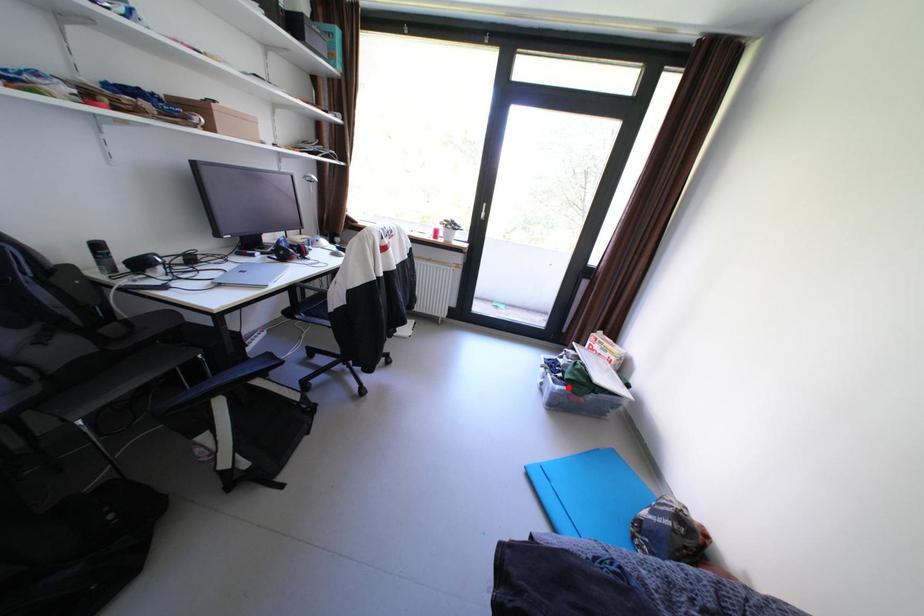
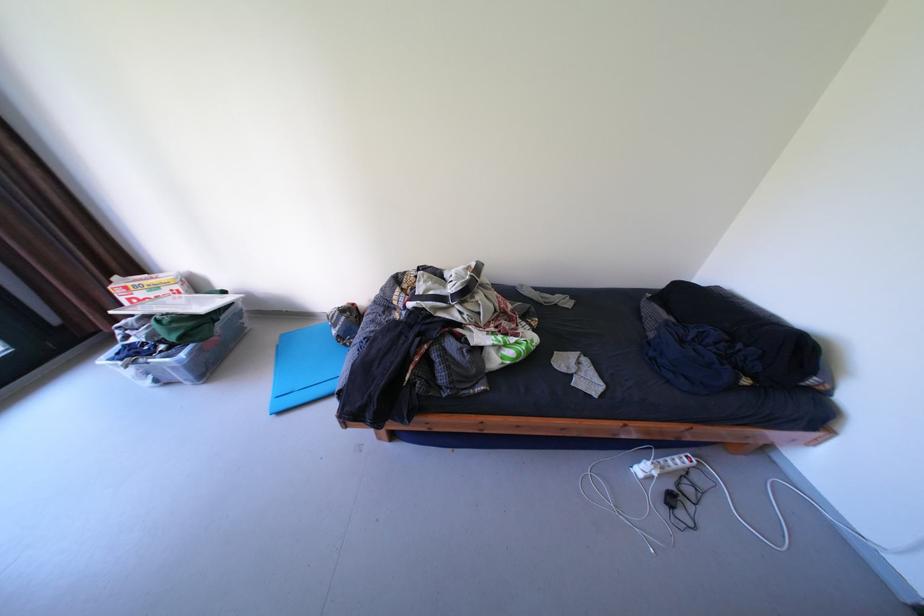
Question: A red point is marked in image1. In image2, is the corresponding 3D point closer to the camera or farther? Reply with the corresponding letter.

Choices:
 (A) The corresponding 3D point is closer.
 (B) The corresponding 3D point is farther.

Answer: (B)